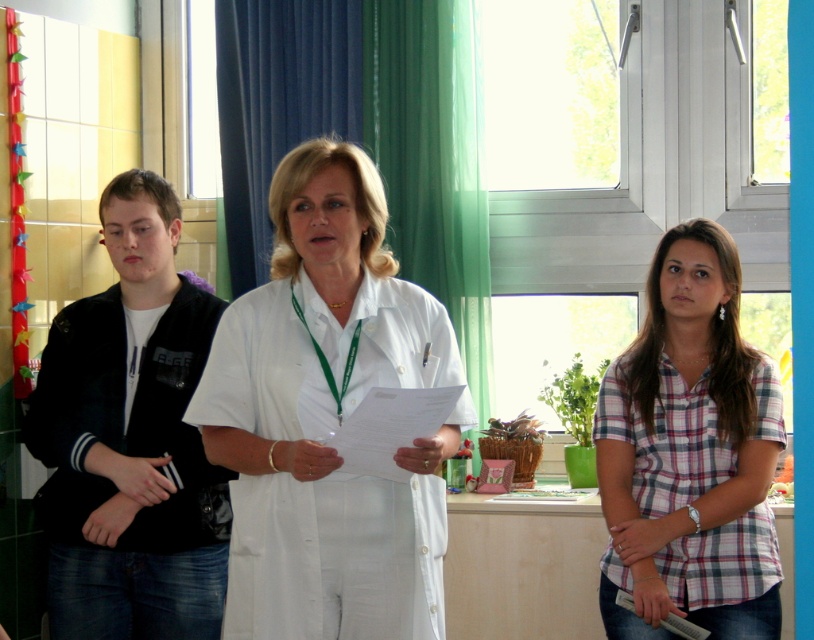
Does white matte uniform at center have a lesser width compared to green fabric curtain at center?

Yes.

Does white matte uniform at center lie in front of green fabric curtain at center?

Yes, white matte uniform at center is closer to the viewer.

This screenshot has height=640, width=814. I want to click on white matte uniform at center, so click(327, 417).

Does black matte jacket at left have a lesser height compared to plaid cotton shirt at center?

No, black matte jacket at left is not shorter than plaid cotton shirt at center.

Is black matte jacket at left behind plaid cotton shirt at center?

Yes.

Find the location of a particular element. The width and height of the screenshot is (814, 640). black matte jacket at left is located at coordinates pos(130,440).

In the scene shown: Is white matte uniform at center above black matte jacket at left?

Yes.

Who is more distant from viewer, (x=239, y=452) or (x=46, y=422)?

Point (x=46, y=422)

Find the location of a particular element. This screenshot has height=640, width=814. white matte uniform at center is located at coordinates (327, 417).